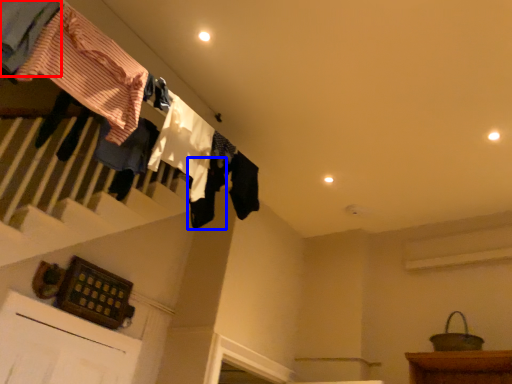
Question: Which object appears closest to the camera in this image, clothing (highlighted by a red box) or clothing (highlighted by a blue box)?

Choices:
 (A) clothing
 (B) clothing

Answer: (A)